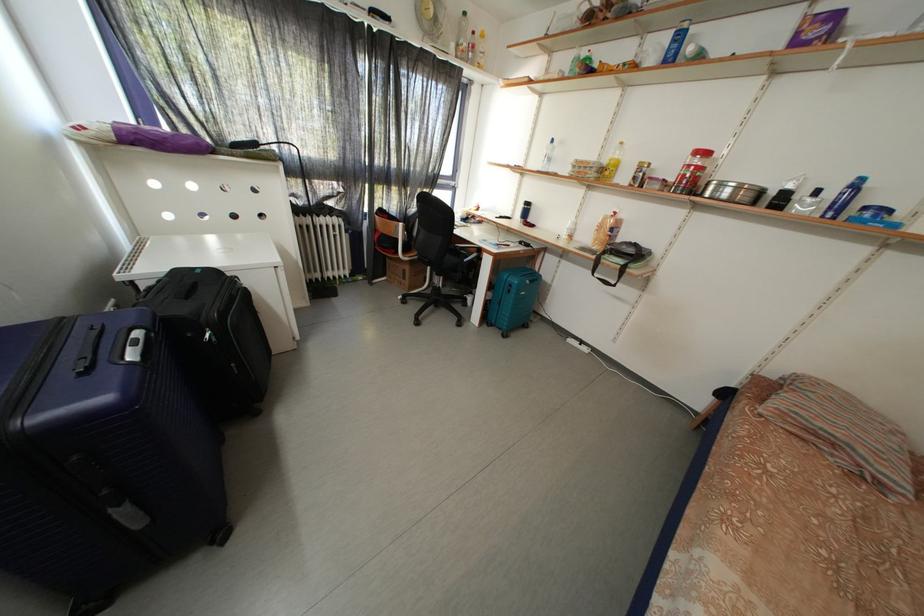
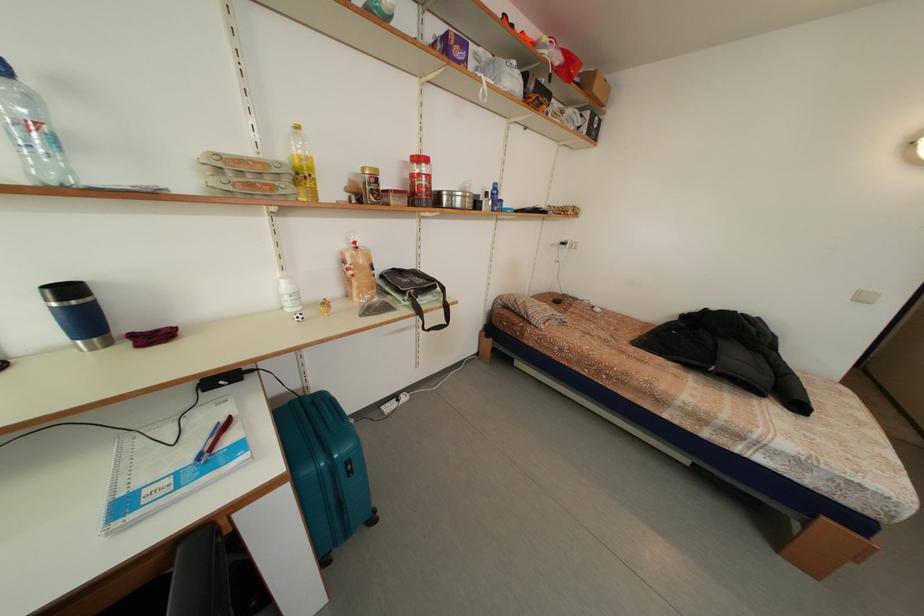
Find the pixel in the second image that matches point 626,272 in the first image.

(448, 310)